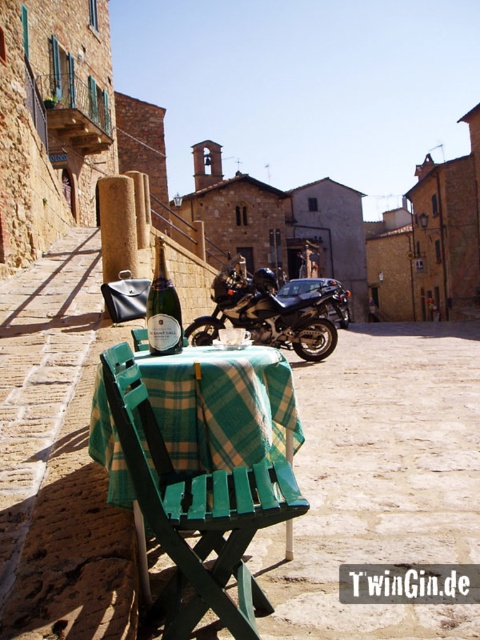
Who is more distant from viewer, (60, 232) or (159, 266)?

The point (60, 232) is behind.

From the picture: Which is above, green plaid tablecloth at center or matte glass champagne bottle at center?

green plaid tablecloth at center is above.

Is point (180, 109) more distant than point (159, 266)?

Yes, it is.

Locate an element on the screen. green plaid tablecloth at center is located at coordinates (304, 83).

Locate an element on the screen. This screenshot has width=480, height=640. green plastic chair at center is located at coordinates (195, 512).

Can you confirm if green plastic chair at center is positioned below shiny black motorcycle at center?

Yes.

Describe the element at coordinates (195, 512) in the screenshot. I see `green plastic chair at center` at that location.

I want to click on green plastic chair at center, so coord(195,512).

Can you confirm if green plaid tablecloth at center is smaller than shiny black motorcycle at center?

Incorrect, green plaid tablecloth at center is not smaller in size than shiny black motorcycle at center.

Which is more to the left, green plaid tablecloth at center or shiny black motorcycle at center?

shiny black motorcycle at center

This screenshot has width=480, height=640. Identify the location of green plaid tablecloth at center. (304, 83).